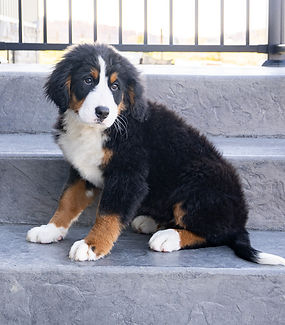
Find the location of a particular element. Image resolution: width=285 pixels, height=325 pixels. left front leg is located at coordinates (119, 217).